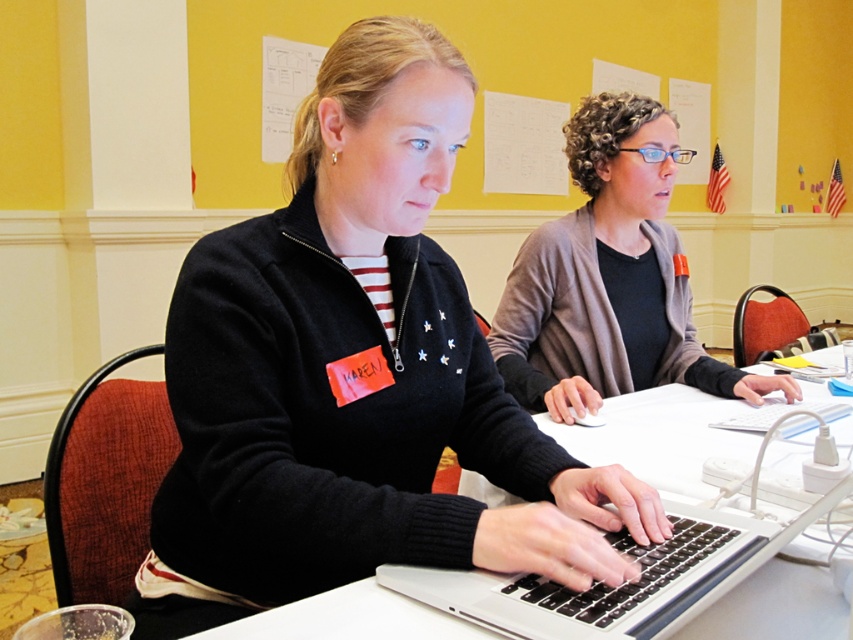
Question: Among these points, which one is farthest from the camera?

Choices:
 (A) (456, 189)
 (B) (618, 429)
 (C) (703, 352)

Answer: (A)

Question: Which point is farther to the camera?

Choices:
 (A) silver/black keyboard at center
 (B) black matte sweater at center
 (C) white paperboard at upper center

Answer: (C)

Question: Is black matte sweater at center positioned in front of white paperboard at upper center?

Choices:
 (A) no
 (B) yes

Answer: (B)

Question: Is black matte sweater at center above matte gray sweater at center?

Choices:
 (A) yes
 (B) no

Answer: (B)

Question: Which point is farther to the camera?

Choices:
 (A) white paperboard at upper center
 (B) black matte sweater at center
 (C) matte gray sweater at center
 (D) white plastic table at center

Answer: (A)

Question: Observing the image, what is the correct spatial positioning of matte gray sweater at center in reference to white plastic table at center?

Choices:
 (A) below
 (B) above

Answer: (B)